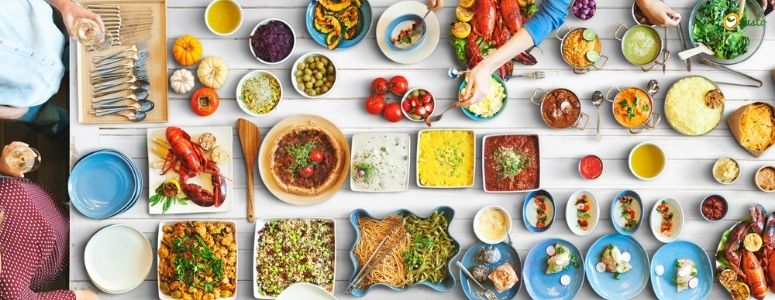
Where is `square dish`? The image size is (775, 300). square dish is located at coordinates (214, 265), (273, 264), (212, 166), (384, 158), (448, 154), (518, 156).